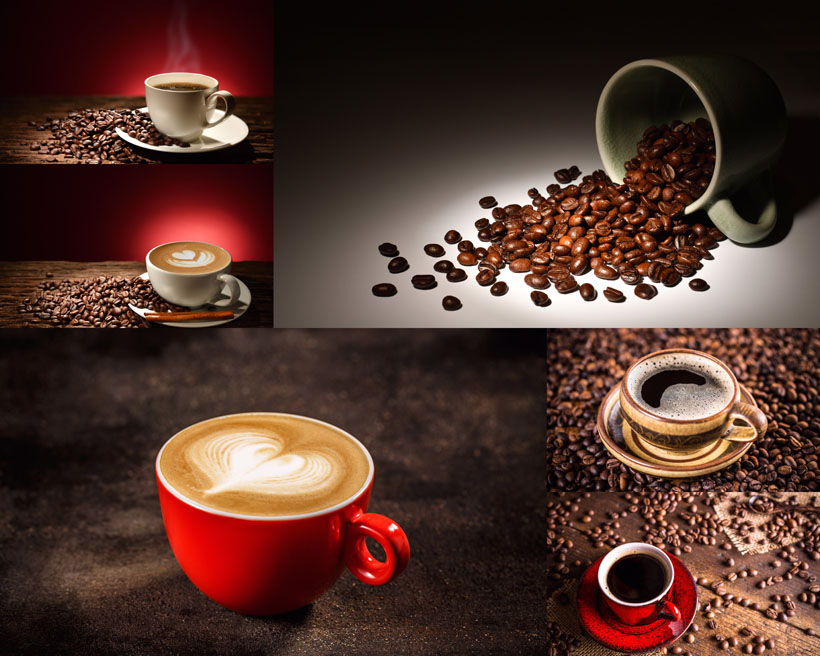
You are a GUI agent. You are given a task and a screenshot of the screen. Output one action in this format:
    pyautogui.click(x=<x>, y=<y>)
    Task: Click on the mugs
    
    Given the screenshot: What is the action you would take?
    pyautogui.click(x=180, y=88), pyautogui.click(x=198, y=276), pyautogui.click(x=267, y=475), pyautogui.click(x=668, y=401), pyautogui.click(x=679, y=128)